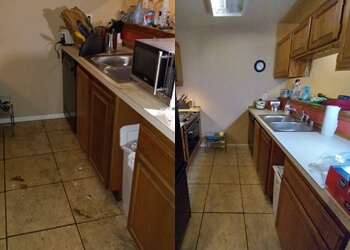
The width and height of the screenshot is (350, 250). Find the location of `before and after kitchen cleaned`. before and after kitchen cleaned is located at coordinates (215, 64).